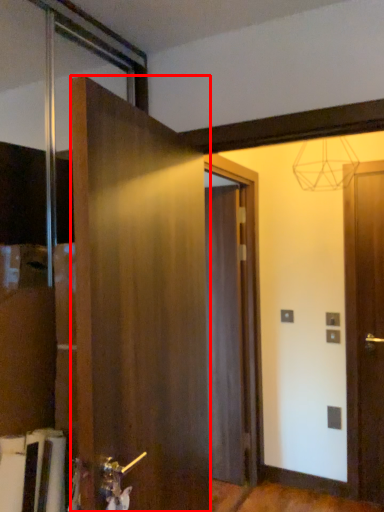
Question: From the image's perspective, considering the relative positions of door (annotated by the red box) and door in the image provided, where is door (annotated by the red box) located with respect to the staircase?

Choices:
 (A) below
 (B) above

Answer: (B)